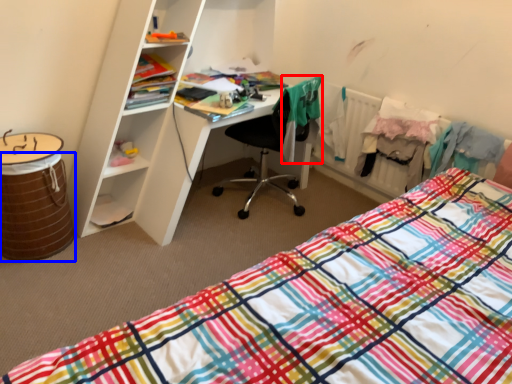
Question: Which object is further to the camera taking this photo, clothing (highlighted by a red box) or barrel (highlighted by a blue box)?

Choices:
 (A) clothing
 (B) barrel

Answer: (A)